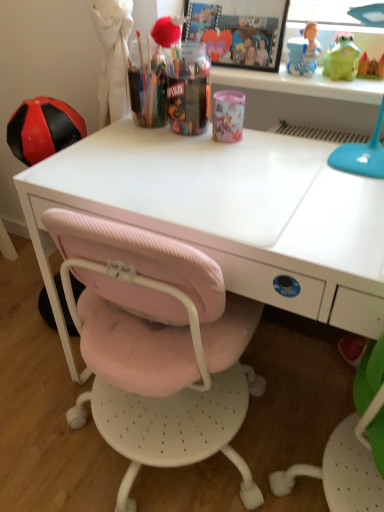
What do you see at coordinates (342, 59) in the screenshot?
I see `green rubber frog at upper right, the 2th toy positioned from the right` at bounding box center [342, 59].

Find the location of `pink fabric chair at lower left`. pink fabric chair at lower left is located at coordinates (157, 346).

Measure the distance between pink glossy cup at center, which ranks as the 2th stationery in left-to-right order, and camera.

pink glossy cup at center, which ranks as the 2th stationery in left-to-right order, and camera are 1.03 meters apart.

The height and width of the screenshot is (512, 384). Describe the element at coordinates (229, 215) in the screenshot. I see `white matte desk at center` at that location.

You are a GUI agent. You are given a task and a screenshot of the screen. Output one action in this format:
    pyautogui.click(x=<x>, y=<y>)
    Task: Click on the matte green toy at upper right, which appears as the first toy when viewed from the right
    The image size is (384, 512).
    Given the screenshot: What is the action you would take?
    pyautogui.click(x=371, y=66)

I want to click on chair below the pink glossy cup at center, which ranks as the 2th stationery in left-to-right order (from a real-world perspective), so click(157, 346).

Can you confirm if pink glossy cup at center, the 1th stationery positioned from the right, is smaller than pink fabric chair at lower left?

Indeed, pink glossy cup at center, the 1th stationery positioned from the right, has a smaller size compared to pink fabric chair at lower left.

From the image's perspective, is pink glossy cup at center, which ranks as the 2th stationery in left-to-right order, below pink fabric chair at lower left?

No, from the image's perspective, pink glossy cup at center, which ranks as the 2th stationery in left-to-right order, is not beneath pink fabric chair at lower left.

Can you tell me how much pink glossy cup at center, the 1th stationery positioned from the right, and pink fabric chair at lower left differ in facing direction?

They differ by 1.61 degrees in their facing directions.

Considering their positions, is matte green toy at upper right, which appears as the first toy when viewed from the right, located in front of or behind translucent plastic container at center, arranged as the 1th stationery when viewed from the left?

Visually, matte green toy at upper right, which appears as the first toy when viewed from the right, is located behind translucent plastic container at center, arranged as the 1th stationery when viewed from the left.

From a real-world perspective, is matte green toy at upper right, which appears as the first toy when viewed from the right, physically above translucent plastic container at center, the 2th stationery in the right-to-left sequence?

Correct, in the physical world, matte green toy at upper right, which appears as the first toy when viewed from the right, is higher than translucent plastic container at center, the 2th stationery in the right-to-left sequence.

From the image's perspective, would you say matte green toy at upper right, arranged as the second toy when viewed from the left, is shown under translucent plastic container at center, arranged as the 1th stationery when viewed from the left?

No, from the image's perspective, matte green toy at upper right, arranged as the second toy when viewed from the left, is not below translucent plastic container at center, arranged as the 1th stationery when viewed from the left.

Is matte green toy at upper right, which appears as the first toy when viewed from the right, not within translucent plastic container at center, arranged as the 1th stationery when viewed from the left?

That's correct, matte green toy at upper right, which appears as the first toy when viewed from the right, is outside of translucent plastic container at center, arranged as the 1th stationery when viewed from the left.

Considering the sizes of objects matte green toy at upper right, arranged as the second toy when viewed from the left, and pink glossy cup at center, which ranks as the 2th stationery in left-to-right order, in the image provided, who is thinner, matte green toy at upper right, arranged as the second toy when viewed from the left, or pink glossy cup at center, which ranks as the 2th stationery in left-to-right order,?

Thinner between the two is matte green toy at upper right, arranged as the second toy when viewed from the left.

Based on the photo, how distant is matte green toy at upper right, which appears as the first toy when viewed from the right, from pink glossy cup at center, which ranks as the 2th stationery in left-to-right order?

matte green toy at upper right, which appears as the first toy when viewed from the right, and pink glossy cup at center, which ranks as the 2th stationery in left-to-right order, are 14.84 inches apart from each other.

How many degrees apart are the facing directions of matte green toy at upper right, arranged as the second toy when viewed from the left, and pink glossy cup at center, the 1th stationery positioned from the right?

The angle between the facing direction of matte green toy at upper right, arranged as the second toy when viewed from the left, and the facing direction of pink glossy cup at center, the 1th stationery positioned from the right, is 1.73 degrees.

Considering the sizes of objects matte green toy at upper right, which appears as the first toy when viewed from the right, and pink glossy cup at center, the 1th stationery positioned from the right, in the image provided, who is bigger, matte green toy at upper right, which appears as the first toy when viewed from the right, or pink glossy cup at center, the 1th stationery positioned from the right,?

Bigger between the two is pink glossy cup at center, the 1th stationery positioned from the right.

From a real-world perspective, who is located lower, pink fabric chair at lower left or pink glossy cup at center, which ranks as the 2th stationery in left-to-right order?

pink fabric chair at lower left, from a real-world perspective.

In the image, is pink fabric chair at lower left positioned in front of or behind pink glossy cup at center, which ranks as the 2th stationery in left-to-right order?

In the image, pink fabric chair at lower left appears in front of pink glossy cup at center, which ranks as the 2th stationery in left-to-right order.

How much distance is there between pink fabric chair at lower left and pink glossy cup at center, the 1th stationery positioned from the right?

A distance of 20.04 inches exists between pink fabric chair at lower left and pink glossy cup at center, the 1th stationery positioned from the right.

Is pink fabric chair at lower left positioned far away from pink glossy cup at center, which ranks as the 2th stationery in left-to-right order?

No, there isn't a large distance between pink fabric chair at lower left and pink glossy cup at center, which ranks as the 2th stationery in left-to-right order.

Can you confirm if white matte desk at center is positioned to the right of matte green toy at upper right, arranged as the second toy when viewed from the left?

Incorrect, white matte desk at center is not on the right side of matte green toy at upper right, arranged as the second toy when viewed from the left.

Does white matte desk at center lie behind matte green toy at upper right, which appears as the first toy when viewed from the right?

No, white matte desk at center is in front of matte green toy at upper right, which appears as the first toy when viewed from the right.

Looking at this image, can you confirm if white matte desk at center is bigger than matte green toy at upper right, which appears as the first toy when viewed from the right?

Yes.

From the image's perspective, who appears lower, white matte desk at center or matte green toy at upper right, which appears as the first toy when viewed from the right?

white matte desk at center appears lower in the image.

Which object is wider, pink glossy cup at center, the 1th stationery positioned from the right, or translucent plastic container at center, arranged as the 1th stationery when viewed from the left?

translucent plastic container at center, arranged as the 1th stationery when viewed from the left.

Locate an element on the screen. stationery below the translucent plastic container at center, arranged as the 1th stationery when viewed from the left (from the image's perspective) is located at coordinates 228,116.

Is pink glossy cup at center, the 1th stationery positioned from the right, in front of or behind translucent plastic container at center, the 2th stationery in the right-to-left sequence, in the image?

In the image, pink glossy cup at center, the 1th stationery positioned from the right, appears behind translucent plastic container at center, the 2th stationery in the right-to-left sequence.

Between pink glossy cup at center, which ranks as the 2th stationery in left-to-right order, and translucent plastic container at center, the 2th stationery in the right-to-left sequence, which one has smaller size?

Smaller between the two is pink glossy cup at center, which ranks as the 2th stationery in left-to-right order.

In the image, there is a pink glossy cup at center, which ranks as the 2th stationery in left-to-right order. Where is `desk below it (from a real-world perspective)`? This screenshot has height=512, width=384. desk below it (from a real-world perspective) is located at coordinates (229, 215).

Are white matte desk at center and pink glossy cup at center, the 1th stationery positioned from the right, far apart?

Actually, white matte desk at center and pink glossy cup at center, the 1th stationery positioned from the right, are a little close together.

From a real-world perspective, between white matte desk at center and pink glossy cup at center, which ranks as the 2th stationery in left-to-right order, who is vertically lower?

From a 3D spatial view, white matte desk at center is below.

Is point (244, 184) more distant than point (218, 99)?

No, (244, 184) is in front of (218, 99).

Locate an element on the screen. The width and height of the screenshot is (384, 512). chair located in front of the pink glossy cup at center, which ranks as the 2th stationery in left-to-right order is located at coordinates (157, 346).

From a real-world perspective, which toy is the 1st one above the translucent plastic container at center, arranged as the 1th stationery when viewed from the left? Please provide its 2D coordinates.

[(371, 66)]

When comparing their distances from pink fabric chair at lower left, does matte green toy at upper right, which appears as the first toy when viewed from the right, or pink glossy cup at center, which ranks as the 2th stationery in left-to-right order, seem further?

matte green toy at upper right, which appears as the first toy when viewed from the right, is further to pink fabric chair at lower left.

Looking at the image, which one is located further to green rubber frog at upper right, the 2th toy positioned from the right, translucent plastic container at center, arranged as the 1th stationery when viewed from the left, or matte green toy at upper right, arranged as the second toy when viewed from the left?

translucent plastic container at center, arranged as the 1th stationery when viewed from the left, is further to green rubber frog at upper right, the 2th toy positioned from the right.

Estimate the real-world distances between objects in this image. Which object is further from matte green toy at upper right, arranged as the second toy when viewed from the left, pink glossy cup at center, the 1th stationery positioned from the right, or pink fabric chair at lower left?

pink fabric chair at lower left lies further to matte green toy at upper right, arranged as the second toy when viewed from the left, than the other object.

From the image, which object appears to be farther from pink glossy cup at center, the 1th stationery positioned from the right, matte green toy at upper right, arranged as the second toy when viewed from the left, or pink fabric chair at lower left?

pink fabric chair at lower left.

Which object lies nearer to the anchor point pink fabric chair at lower left, green rubber frog at upper right, the 2th toy positioned from the right, or matte green toy at upper right, arranged as the second toy when viewed from the left?

green rubber frog at upper right, the 2th toy positioned from the right, lies closer to pink fabric chair at lower left than the other object.

From the image, which object appears to be nearer to translucent plastic container at center, the 2th stationery in the right-to-left sequence, pink glossy cup at center, which ranks as the 2th stationery in left-to-right order, or white matte desk at center?

pink glossy cup at center, which ranks as the 2th stationery in left-to-right order.

Based on their spatial positions, is translucent plastic container at center, arranged as the 1th stationery when viewed from the left, or pink fabric chair at lower left closer to pink glossy cup at center, which ranks as the 2th stationery in left-to-right order?

Based on the image, translucent plastic container at center, arranged as the 1th stationery when viewed from the left, appears to be nearer to pink glossy cup at center, which ranks as the 2th stationery in left-to-right order.

Based on their spatial positions, is matte green toy at upper right, arranged as the second toy when viewed from the left, or green rubber frog at upper right, arranged as the first toy when viewed from the left, closer to white matte desk at center?

Among the two, green rubber frog at upper right, arranged as the first toy when viewed from the left, is located nearer to white matte desk at center.

Image resolution: width=384 pixels, height=512 pixels. In order to click on stationery between translucent plastic container at center, the 2th stationery in the right-to-left sequence, and white matte desk at center from top to bottom in this screenshot , I will do `click(228, 116)`.

The height and width of the screenshot is (512, 384). Find the location of `desk between green rubber frog at upper right, arranged as the first toy when viewed from the left, and pink fabric chair at lower left vertically`. desk between green rubber frog at upper right, arranged as the first toy when viewed from the left, and pink fabric chair at lower left vertically is located at coordinates (229, 215).

Identify the location of toy between translucent plastic container at center, arranged as the 1th stationery when viewed from the left, and matte green toy at upper right, arranged as the second toy when viewed from the left, from left to right. point(342,59).

Where is `toy that lies between green rubber frog at upper right, arranged as the first toy when viewed from the left, and pink fabric chair at lower left from top to bottom`? This screenshot has height=512, width=384. toy that lies between green rubber frog at upper right, arranged as the first toy when viewed from the left, and pink fabric chair at lower left from top to bottom is located at coordinates pos(371,66).